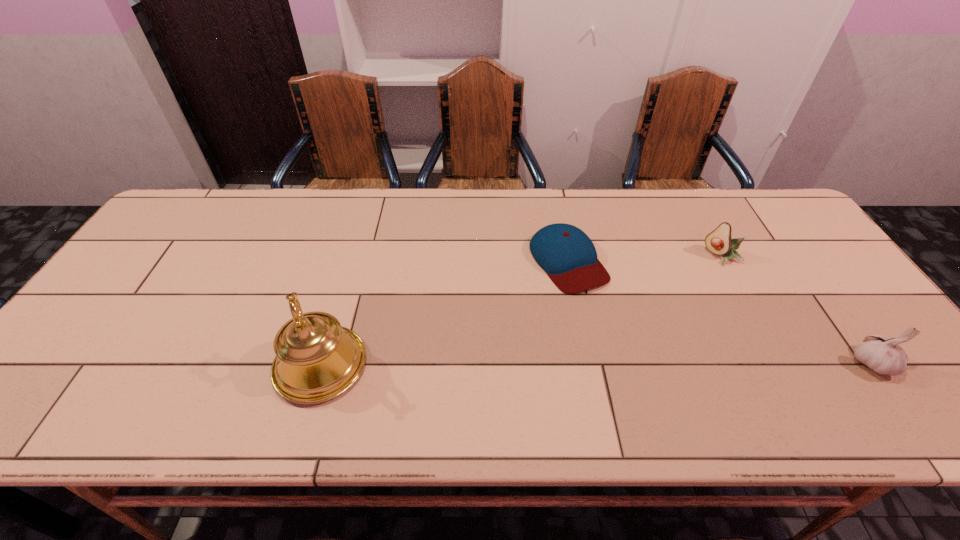
This screenshot has width=960, height=540. In order to click on vacant space at the near edge of the desktop in this screenshot , I will do `click(542, 381)`.

The height and width of the screenshot is (540, 960). Find the location of `vacant space at the right edge of the desktop`. vacant space at the right edge of the desktop is located at coordinates (758, 236).

The image size is (960, 540). In the image, there is a desktop. Find the location of `vacant space at the near left corner`. vacant space at the near left corner is located at coordinates (59, 376).

Identify the location of vacant area that lies between the garlic and the tallest object. The image size is (960, 540). (595, 364).

The height and width of the screenshot is (540, 960). I want to click on empty space between the bell and the rightmost object, so click(x=595, y=364).

Where is `free area in between the garlic and the bell`? Image resolution: width=960 pixels, height=540 pixels. free area in between the garlic and the bell is located at coordinates (595, 364).

Locate an element on the screen. free space between the tallest object and the garlic is located at coordinates (x=595, y=364).

Locate an element on the screen. The image size is (960, 540). free space between the bell and the third object from left to right is located at coordinates (521, 310).

You are a GUI agent. You are given a task and a screenshot of the screen. Output one action in this format:
    pyautogui.click(x=<x>, y=<y>)
    Task: Click on the unoccupied area between the avocado and the rightmost object
    
    Given the screenshot: What is the action you would take?
    pyautogui.click(x=796, y=309)

Find the location of a particular element. vacant space in between the third object from left to right and the tallest object is located at coordinates (521, 310).